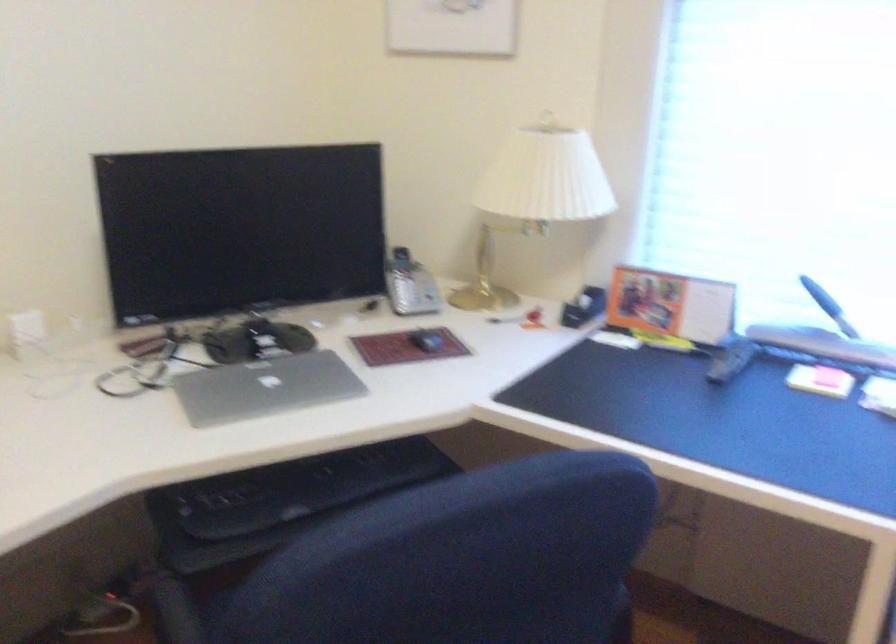
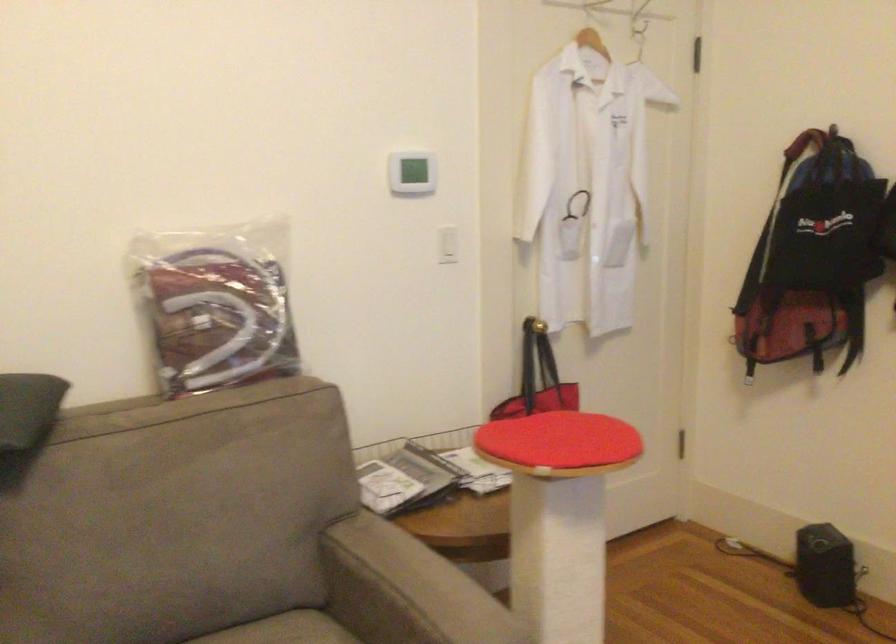
How did the camera likely rotate?

The camera's rotation is toward left-down.